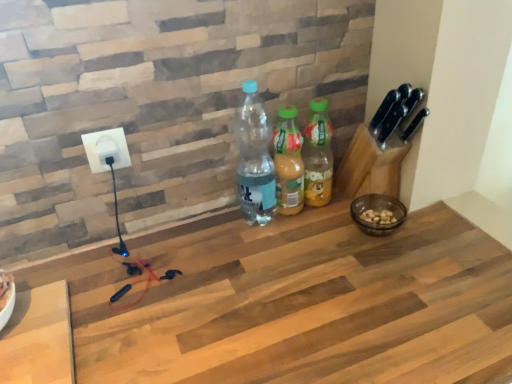
The height and width of the screenshot is (384, 512). I want to click on vacant space to the right of transparent plastic bottle at center, the third bottle from the right, so click(330, 233).